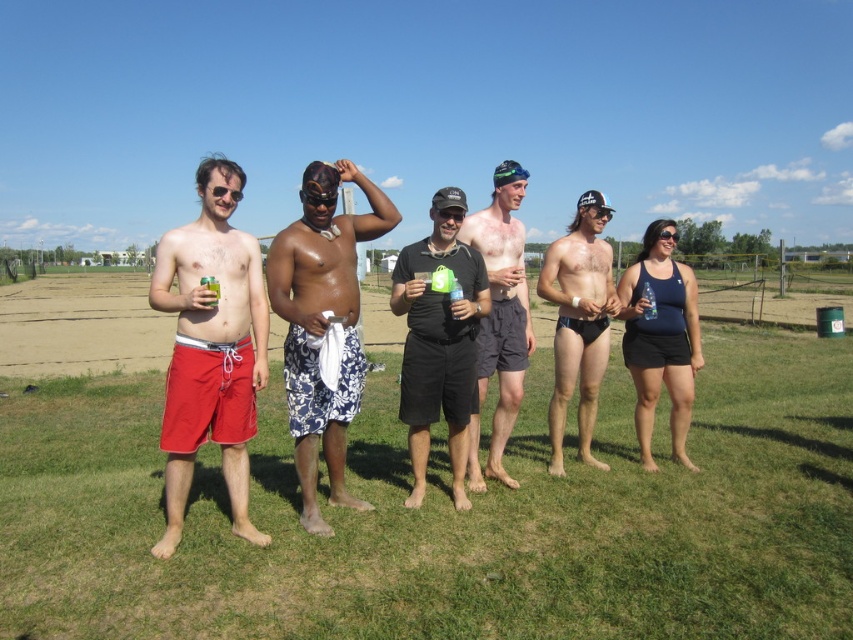
Question: Is blue printed shorts at center bigger than matte black swim trunks at center?

Choices:
 (A) no
 (B) yes

Answer: (B)

Question: Is green grass at center smaller than black matte shorts at center?

Choices:
 (A) yes
 (B) no

Answer: (B)

Question: Which object is positioned closest to the black matte swimsuit at right?

Choices:
 (A) matte black swim trunks at center
 (B) blue printed shorts at center

Answer: (A)

Question: Is blue printed shorts at center to the right of black matte swimsuit at right from the viewer's perspective?

Choices:
 (A) yes
 (B) no

Answer: (B)

Question: Among these points, which one is nearest to the camera?

Choices:
 (A) (698, 417)
 (B) (616, 300)
 (C) (646, 292)
 (D) (488, 209)

Answer: (D)

Question: Estimate the real-world distances between objects in this image. Which object is farther from the black matte shorts at center?

Choices:
 (A) matte black swim trunks at center
 (B) black matte swimsuit at right

Answer: (B)